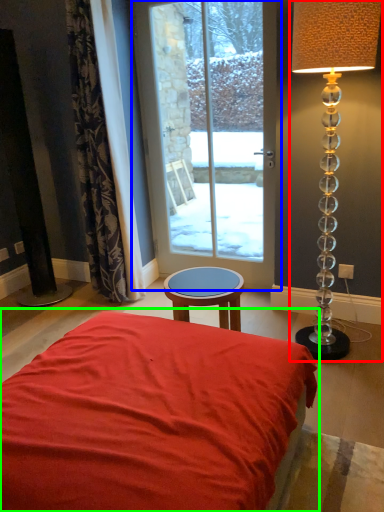
Question: Considering the real-world distances, which object is farthest from lamp (highlighted by a red box)? door (highlighted by a blue box) or bed (highlighted by a green box)?

Choices:
 (A) door
 (B) bed

Answer: (A)